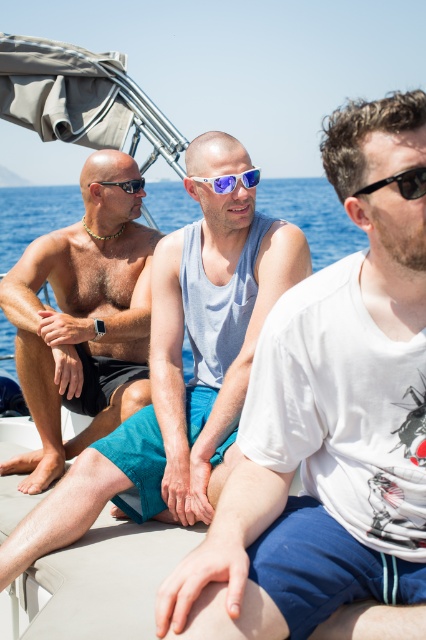
Between point (157, 240) and point (210, 180), which one is positioned in front?

Point (210, 180) is more forward.

Who is more distant from viewer, [106,304] or [249,173]?

Point [106,304]

Which is in front, point (77, 321) or point (230, 176)?

Point (230, 176) is in front.

This screenshot has height=640, width=426. What are the coordinates of `bare chested torso at center` in the screenshot? It's located at (83, 317).

Is gray fabric tank top at center to the right of blue reflective lenses at center from the viewer's perspective?

In fact, gray fabric tank top at center is to the left of blue reflective lenses at center.

Does gray fabric tank top at center have a lesser width compared to blue reflective lenses at center?

Yes.

Is point (183, 506) more distant than point (222, 188)?

That is False.

The height and width of the screenshot is (640, 426). What are the coordinates of `gray fabric tank top at center` in the screenshot? It's located at (181, 365).

Between point (284, 196) and point (230, 189), which one is positioned in front?

Point (230, 189)

Where is `blue water at center`? The height and width of the screenshot is (640, 426). blue water at center is located at coordinates (311, 216).